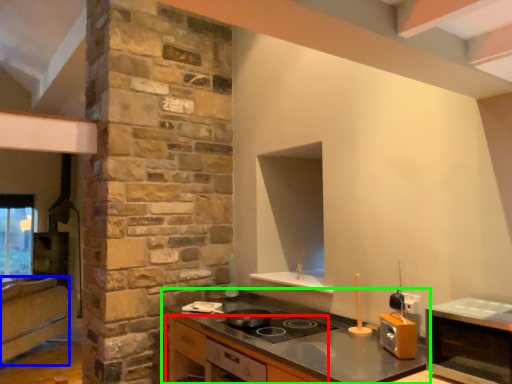
Question: Based on their relative distances, which object is nearer to cabinetry (highlighted by a red box)? Choose from cabinetry (highlighted by a blue box) and countertop (highlighted by a green box).

Choices:
 (A) cabinetry
 (B) countertop

Answer: (B)